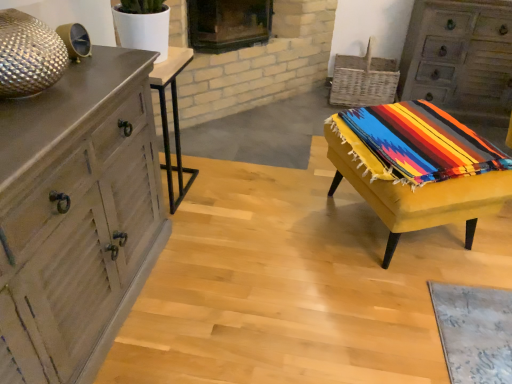
You are a GUI agent. You are given a task and a screenshot of the screen. Output one action in this format:
    pyautogui.click(x=<x>, y=<y>)
    Task: Click on the blank area beneath wooden table at left, which is the first table in left-to-right order (from a real-world perspective)
    The width and height of the screenshot is (512, 384).
    Given the screenshot: What is the action you would take?
    pyautogui.click(x=176, y=186)